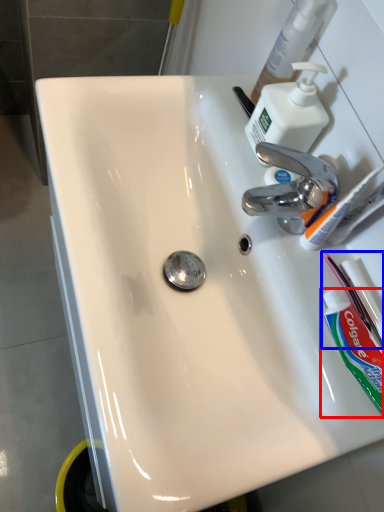
Question: Which of the following is the closest to the observer, toothpaste (highlighted by a red box) or toothbrush (highlighted by a blue box)?

Choices:
 (A) toothpaste
 (B) toothbrush

Answer: (A)